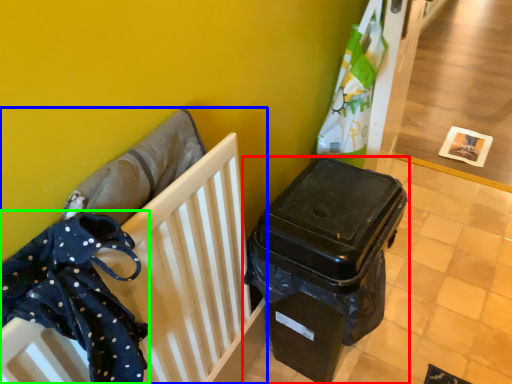
Question: Which object is the farthest from waste container (highlighted by a red box)? Choose among these: furniture (highlighted by a blue box) or clothe (highlighted by a green box).

Choices:
 (A) furniture
 (B) clothe

Answer: (B)